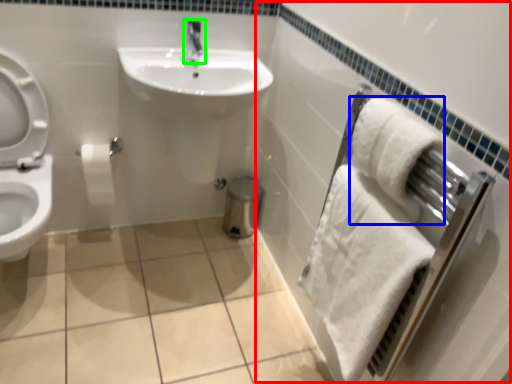
Question: Which object is positioned farthest from bath (highlighted by a red box)? Select from bath towel (highlighted by a blue box) and tap (highlighted by a green box).

Choices:
 (A) bath towel
 (B) tap

Answer: (B)